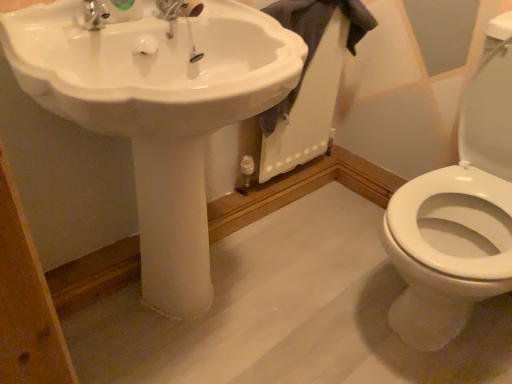
Locate an element on the screen. white glossy sink at center is located at coordinates (158, 112).

The height and width of the screenshot is (384, 512). What do you see at coordinates (158, 112) in the screenshot?
I see `white glossy sink at center` at bounding box center [158, 112].

Describe the element at coordinates (313, 38) in the screenshot. I see `gray cotton towel at upper right` at that location.

Measure the distance between point (x=290, y=98) and camera.

Point (x=290, y=98) is 1.38 meters from camera.

Where is `gray cotton towel at upper right`? This screenshot has height=384, width=512. gray cotton towel at upper right is located at coordinates (313, 38).

Image resolution: width=512 pixels, height=384 pixels. In order to click on white glossy sink at center in this screenshot , I will do `click(158, 112)`.

Can you confirm if gray cotton towel at upper right is positioned to the left of white glossy sink at center?

Incorrect, gray cotton towel at upper right is not on the left side of white glossy sink at center.

Which object is more forward, gray cotton towel at upper right or white glossy sink at center?

white glossy sink at center is in front.

Between point (353, 40) and point (58, 18), which one is positioned in front?

The point (58, 18) is in front.

From the image's perspective, is gray cotton towel at upper right located above or below white glossy sink at center?

gray cotton towel at upper right is situated higher than white glossy sink at center in the image.

Consider the image. From a real-world perspective, who is located lower, gray cotton towel at upper right or white glossy sink at center?

white glossy sink at center.

Considering the sizes of gray cotton towel at upper right and white glossy sink at center in the image, is gray cotton towel at upper right wider or thinner than white glossy sink at center?

In the image, gray cotton towel at upper right appears to be more narrow than white glossy sink at center.

Who is shorter, gray cotton towel at upper right or white glossy sink at center?

With less height is gray cotton towel at upper right.

From the picture: Can you confirm if gray cotton towel at upper right is smaller than white glossy sink at center?

Yes, gray cotton towel at upper right is smaller than white glossy sink at center.

Would you say gray cotton towel at upper right contains white glossy sink at center?

Definitely not — white glossy sink at center is not inside gray cotton towel at upper right.

Is gray cotton towel at upper right positioned far away from white glossy sink at center?

gray cotton towel at upper right is near white glossy sink at center, not far away.

Is gray cotton towel at upper right turned away from white glossy sink at center?

No, gray cotton towel at upper right is not facing the opposite direction of white glossy sink at center.

How different are the orientations of gray cotton towel at upper right and white glossy sink at center in degrees?

There is a 0.00204-degree angle between the facing directions of gray cotton towel at upper right and white glossy sink at center.

Where is `sink located underneath the gray cotton towel at upper right (from a real-world perspective)`? sink located underneath the gray cotton towel at upper right (from a real-world perspective) is located at coordinates (158, 112).

Is white glossy sink at center to the left of gray cotton towel at upper right from the viewer's perspective?

Yes, white glossy sink at center is to the left of gray cotton towel at upper right.

Which object is further away from the camera, white glossy sink at center or gray cotton towel at upper right?

gray cotton towel at upper right is further from the camera.

Considering the points (75, 74) and (265, 117), which point is behind, point (75, 74) or point (265, 117)?

Point (265, 117)

From the image's perspective, would you say white glossy sink at center is positioned over gray cotton towel at upper right?

No, from the image's perspective, white glossy sink at center is not over gray cotton towel at upper right.

From a real-world perspective, which object rests below the other?

white glossy sink at center.

Is white glossy sink at center wider or thinner than gray cotton towel at upper right?

white glossy sink at center is wider than gray cotton towel at upper right.

Is white glossy sink at center taller or shorter than gray cotton towel at upper right?

Considering their sizes, white glossy sink at center has more height than gray cotton towel at upper right.

Which of these two, white glossy sink at center or gray cotton towel at upper right, is smaller?

gray cotton towel at upper right.

Is white glossy sink at center spatially inside gray cotton towel at upper right, or outside of it?

white glossy sink at center is spatially situated outside gray cotton towel at upper right.

Are white glossy sink at center and gray cotton towel at upper right far apart?

No, there isn't a large distance between white glossy sink at center and gray cotton towel at upper right.

Is white glossy sink at center positioned with its back to gray cotton towel at upper right?

No, white glossy sink at center's orientation is not away from gray cotton towel at upper right.

What's the angular difference between white glossy sink at center and gray cotton towel at upper right's facing directions?

0.00204 degrees.

Where is `bath towel lying on the right of white glossy sink at center`? The width and height of the screenshot is (512, 384). bath towel lying on the right of white glossy sink at center is located at coordinates (313, 38).

I want to click on sink below the gray cotton towel at upper right (from a real-world perspective), so click(158, 112).

I want to click on bath towel located above the white glossy sink at center (from a real-world perspective), so click(313, 38).